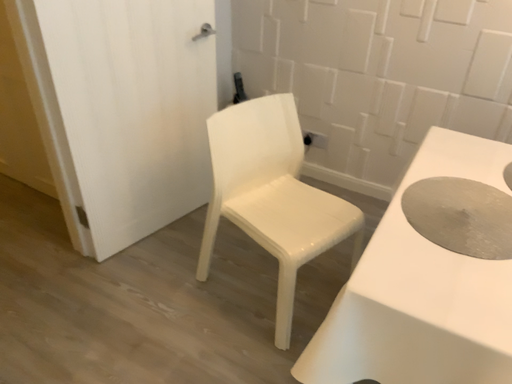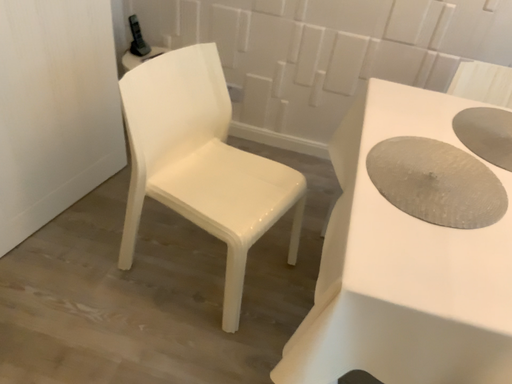
Question: Which way did the camera rotate in the video?

Choices:
 (A) rotated downward
 (B) rotated upward

Answer: (A)